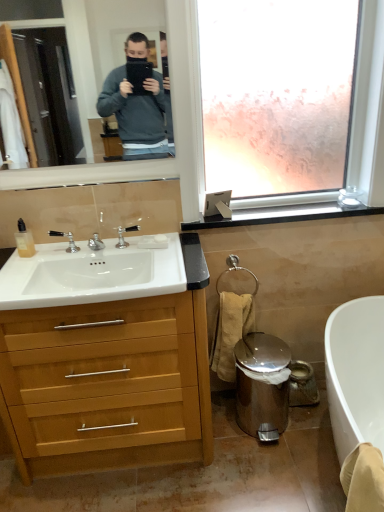
The height and width of the screenshot is (512, 384). Identify the location of vacant position to the left of polished chrome faucet at sink left, the 1th faucet from the left. (29, 261).